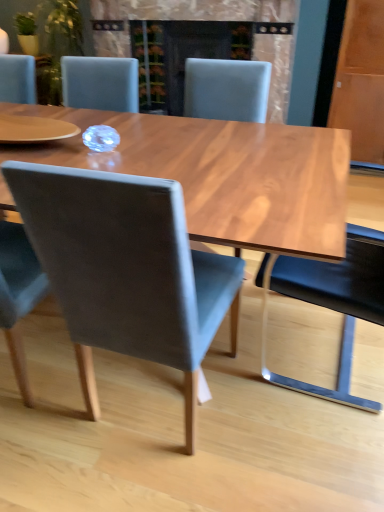
Question: Is matte gray chair at center, the second chair viewed from the right, bigger or smaller than black leather chair at right, which is the 4th chair from left to right?

Choices:
 (A) big
 (B) small

Answer: (B)

Question: Looking at their shapes, would you say matte gray chair at center, the 3th chair positioned from the left, is wider or thinner than black leather chair at right, which is the 4th chair from left to right?

Choices:
 (A) wide
 (B) thin

Answer: (A)

Question: Which object is the farthest from the black leather chair at right, which ranks as the 1th chair in right-to-left order?

Choices:
 (A) matte gray chair at center, the 3th chair positioned from the left
 (B) velvet grey chair at center, which is counted as the 3th chair, starting from the right
 (C) matte black fireplace at center
 (D) matte gray chair at center, which is the first chair from left to right

Answer: (C)

Question: Based on their relative distances, which object is farther from the matte black fireplace at center?

Choices:
 (A) velvet grey chair at center, the second chair viewed from the left
 (B) black leather chair at right, which is the 4th chair from left to right
 (C) matte gray chair at center, which is the first chair from left to right
 (D) matte gray chair at center, the 3th chair positioned from the left

Answer: (A)